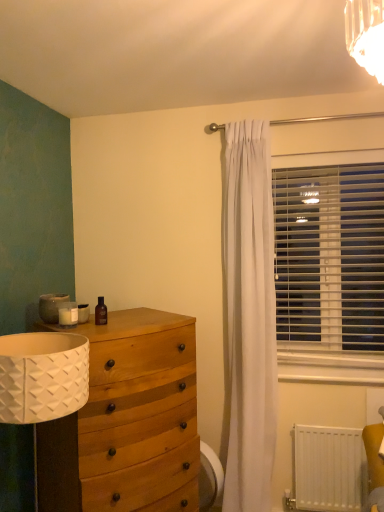
Locate an element on the screen. The height and width of the screenshot is (512, 384). unoccupied space behind brown glass bottle at upper left is located at coordinates (120, 320).